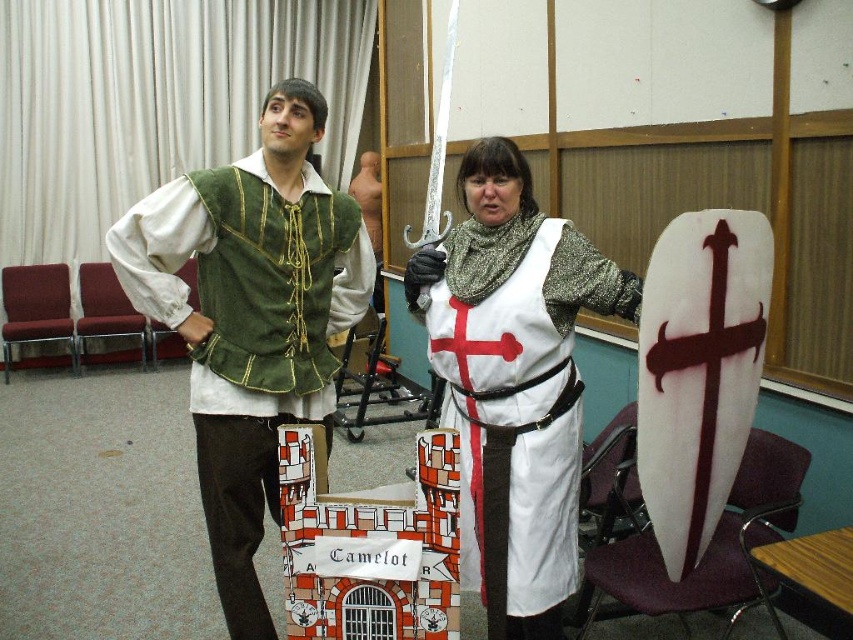
You are a photographer at a cosplay event and need to take a photo of the green velvet vest at left. You are currently standing 6 feet away from the vest. Can you capture the entire vest in your shot without moving closer?

The green velvet vest at left and camera are 6.50 feet apart from each other. Since you are standing 6 feet away, you are close enough to capture the entire vest without needing to move closer.

What is the spatial relationship between the green velvet vest at left and the point at coordinates [247,333]?

The green velvet vest at left is represented by the point at coordinates [247,333].

You are an event planner setting up a photo booth area. You need to place a backdrop at the point where the green velvet vest at left is located. What are the coordinates of that location?

The coordinates of the green velvet vest at left are at point (247, 333).